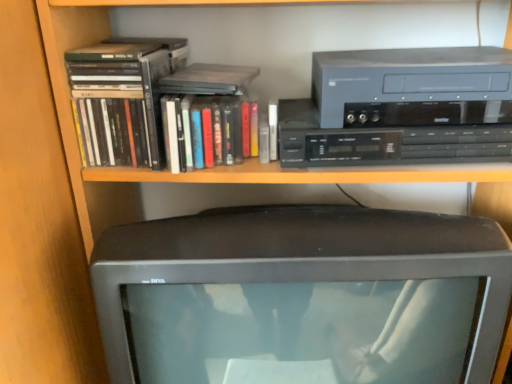
Question: Looking at the image, does matte gray cassette at upper right, the first cassette viewed from the top, seem bigger or smaller compared to matte black book at upper left, which ranks as the 1th book in left-to-right order?

Choices:
 (A) big
 (B) small

Answer: (A)

Question: Considering the positions of point (484, 84) and point (148, 165), is point (484, 84) closer or farther from the camera than point (148, 165)?

Choices:
 (A) closer
 (B) farther

Answer: (A)

Question: Which of these objects is positioned farthest from the hardcover book at upper center?

Choices:
 (A) matte black book at upper left, the 2th book viewed from the right
 (B) matte gray cassette at upper right, the first cassette viewed from the top
 (C) black plastic cassette at upper right, arranged as the first cassette when ordered from the bottom
 (D) matte black monitor at center
 (E) hardcover book at center, which is the first book from right to left

Answer: (D)

Question: Estimate the real-world distances between objects in this image. Which object is farther from the matte black book at upper left, which ranks as the 1th book in left-to-right order?

Choices:
 (A) hardcover book at upper center
 (B) matte black monitor at center
 (C) black plastic cassette at upper right, arranged as the first cassette when ordered from the bottom
 (D) hardcover book at center, acting as the second book starting from the left
 (E) matte gray cassette at upper right, positioned as the second cassette in bottom-to-top order

Answer: (E)